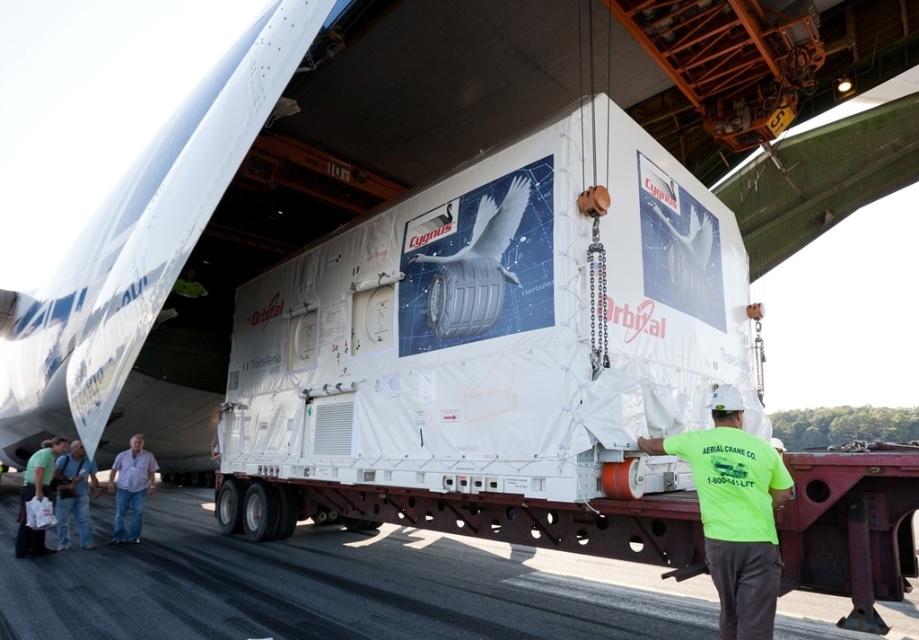
You are a photographer standing at the center of the scene. You want to take a picture of the denim jeans at lower left. Where should you point your camera relative to your current position?

The denim jeans at lower left are located at point 0.762 on the x axis and 0.143 on the y axis, so you should point your camera to the lower left direction from your current position.

Looking at this image, you are a delivery driver who needs to park your truck in a space that must accommodate both the asphalt at lower center and the denim pants at lower left. Given their sizes, will the truck fit properly in the parking spot?

The asphalt at lower center is wider than the denim pants at lower left. Since the truck needs to fit in a space accommodating both, the asphalt at lower center provides sufficient width for the truck to park properly.